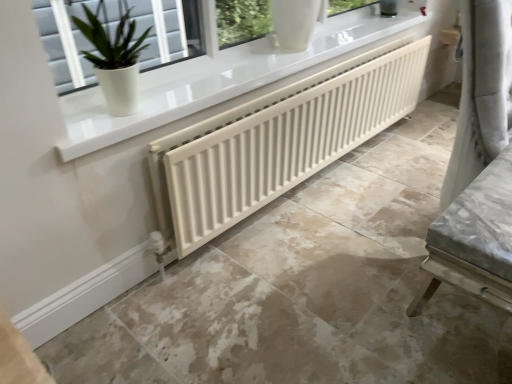
Question: Considering the positions of white matte radiator at center and white matte radiator at center in the image, is white matte radiator at center wider or thinner than white matte radiator at center?

Choices:
 (A) thin
 (B) wide

Answer: (B)

Question: Is white matte radiator at center in front of or behind white matte radiator at center in the image?

Choices:
 (A) front
 (B) behind

Answer: (A)

Question: Estimate the real-world distances between objects in this image. Which object is closer to the white matte radiator at center?

Choices:
 (A) white glossy pot at upper left
 (B) white matte radiator at center

Answer: (B)

Question: Which is farther from the white glossy pot at upper left?

Choices:
 (A) white matte radiator at center
 (B) white matte radiator at center

Answer: (A)